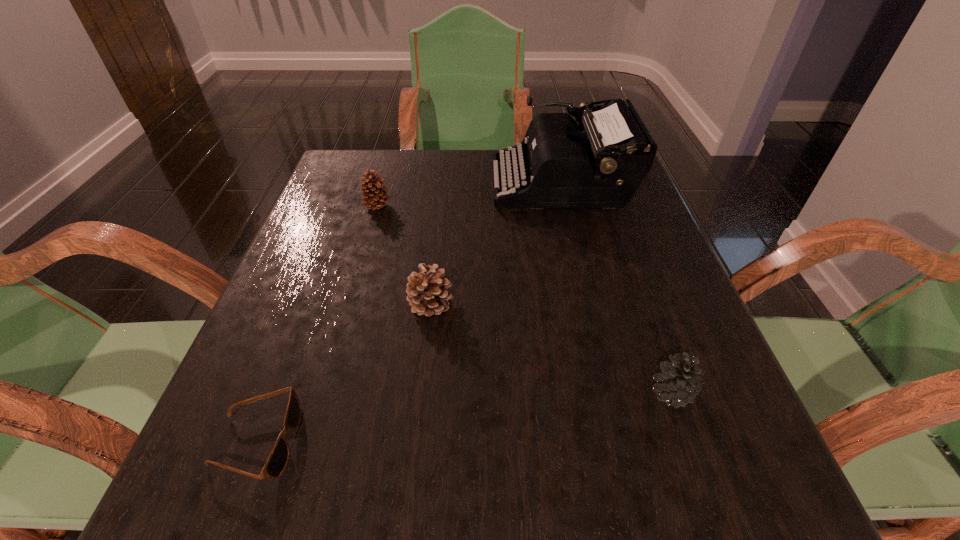
The height and width of the screenshot is (540, 960). I want to click on free spot between the shortest object and the second pinecone from right to left, so click(344, 373).

This screenshot has width=960, height=540. What are the coordinates of `free area in between the tallest object and the leftmost pinecone` in the screenshot? It's located at (468, 194).

Image resolution: width=960 pixels, height=540 pixels. In order to click on blank region between the second pinecone from right to left and the tallest object in this screenshot , I will do `click(496, 243)`.

This screenshot has height=540, width=960. I want to click on free point between the third object from right to left and the leftmost pinecone, so click(404, 255).

Find the location of a particular element. This screenshot has height=540, width=960. free space between the shortest object and the third nearest object is located at coordinates (344, 373).

The width and height of the screenshot is (960, 540). Identify the location of vacant space that's between the tallest object and the third farthest object. (496, 243).

Identify the location of blank region between the shortest object and the farthest pinecone. (317, 324).

Locate which object ranks in proximity to the nearest pinecone. Please provide its 2D coordinates. Your answer should be formatted as a tuple, i.e. [(x, y)], where the tuple contains the x and y coordinates of a point satisfying the conditions above.

[(427, 292)]

Point out which object is positioned as the second nearest to the tallest object. Please provide its 2D coordinates. Your answer should be formatted as a tuple, i.e. [(x, y)], where the tuple contains the x and y coordinates of a point satisfying the conditions above.

[(374, 199)]

Select which pinecone appears as the second closest to the shortest object. Please provide its 2D coordinates. Your answer should be formatted as a tuple, i.e. [(x, y)], where the tuple contains the x and y coordinates of a point satisfying the conditions above.

[(374, 199)]